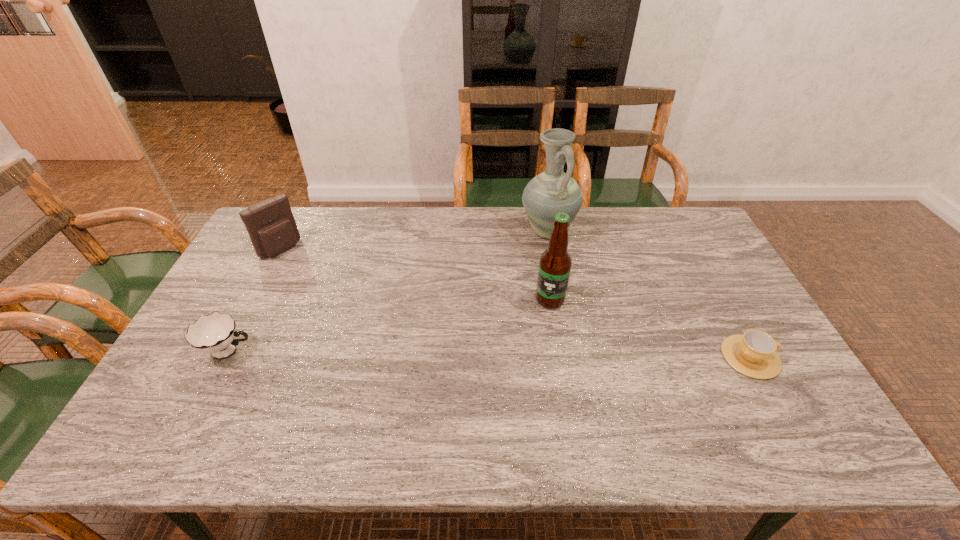
At what (x,y) coordinates should I click in order to perform the action: click on object at the near edge. Please return your answer as a coordinate pair (x, y). Looking at the image, I should click on (753, 354).

You are a GUI agent. You are given a task and a screenshot of the screen. Output one action in this format:
    pyautogui.click(x=<x>, y=<y>)
    Task: Click on the cup that is positioned at the left edge
    This screenshot has height=540, width=960.
    Given the screenshot: What is the action you would take?
    pyautogui.click(x=215, y=333)

Image resolution: width=960 pixels, height=540 pixels. I want to click on pouch that is at the left edge, so click(x=272, y=228).

The width and height of the screenshot is (960, 540). In order to click on object that is at the right edge in this screenshot , I will do `click(753, 354)`.

What are the coordinates of `object that is positioned at the far left corner` in the screenshot? It's located at (272, 228).

Identify the location of object that is at the near right corner. The image size is (960, 540). (753, 354).

Find the location of a particular element. This screenshot has height=540, width=960. free location at the far edge is located at coordinates (470, 208).

Find the location of a particular element. Image resolution: width=960 pixels, height=540 pixels. vacant position at the near edge of the desktop is located at coordinates coord(663,402).

In the image, there is a desktop. At what (x,y) coordinates should I click in order to perform the action: click on vacant space at the left edge. Please return your answer as a coordinate pair (x, y). The height and width of the screenshot is (540, 960). Looking at the image, I should click on (276, 266).

The height and width of the screenshot is (540, 960). In the image, there is a desktop. In order to click on free space at the far right corner in this screenshot , I will do `click(661, 234)`.